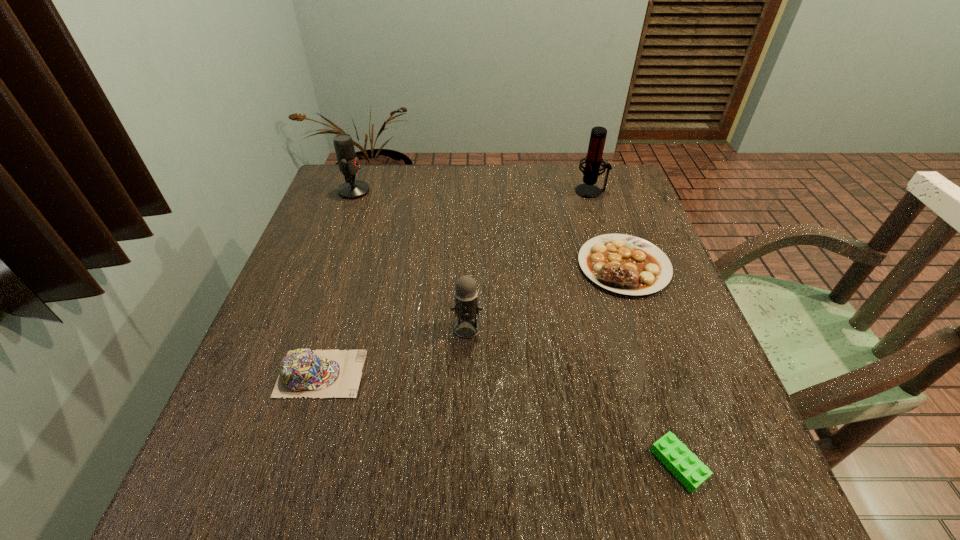
Image resolution: width=960 pixels, height=540 pixels. What are the coordinates of `vacant position in the image that satisfies the following two spatial constraints: 1. on the side of the leftmost microphone with the red ring; 2. on the right side of the fourth nearest object` in the screenshot? It's located at (326, 266).

In order to click on vacant space that satisfies the following two spatial constraints: 1. on the back side of the fourth nearest object; 2. on the side of the leftmost microphone with the red ring in this screenshot , I will do `click(598, 191)`.